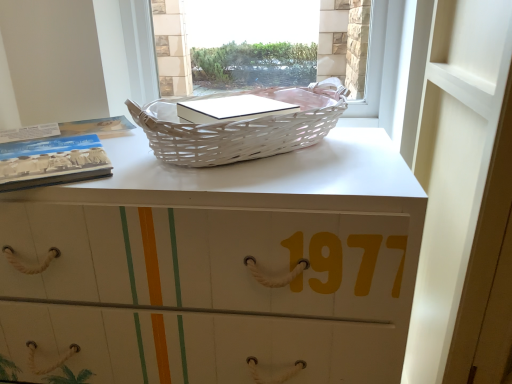
What do you see at coordinates (52, 161) in the screenshot? I see `matte paper book at left` at bounding box center [52, 161].

Where is `white wicker basket at upper center`? This screenshot has height=384, width=512. white wicker basket at upper center is located at coordinates (372, 65).

How different are the orientations of white wicker basket at upper center and white wicker picnic basket at upper center in degrees?

white wicker basket at upper center and white wicker picnic basket at upper center are facing 0.77 degrees away from each other.

The height and width of the screenshot is (384, 512). Identify the location of window behind the white wicker picnic basket at upper center. (372, 65).

Is white wicker basket at upper center at the right side of white wicker picnic basket at upper center?

Yes.

Is the depth of white wicker basket at upper center greater than that of white wicker picnic basket at upper center?

Yes, the depth of white wicker basket at upper center is greater than that of white wicker picnic basket at upper center.

Considering the positions of point (109, 236) and point (156, 112), is point (109, 236) closer or farther from the camera than point (156, 112)?

Point (109, 236) is positioned closer to the camera compared to point (156, 112).

Which object is positioned more to the right, white matte desk at center or white wicker picnic basket at upper center?

white wicker picnic basket at upper center is more to the right.

How far apart are white matte desk at center and white wicker picnic basket at upper center?

white matte desk at center is 8.73 inches away from white wicker picnic basket at upper center.

In the image, there is a white wicker picnic basket at upper center. Identify the location of desk below it (from the image's perspective). click(x=218, y=266).

Considering the relative positions of white matte desk at center and white wicker basket at upper center in the image provided, is white matte desk at center to the right of white wicker basket at upper center from the viewer's perspective?

In fact, white matte desk at center is to the left of white wicker basket at upper center.

Do you think white matte desk at center is within white wicker basket at upper center, or outside of it?

white matte desk at center is outside white wicker basket at upper center.

Considering the positions of objects white matte desk at center and white wicker basket at upper center in the image provided, who is behind, white matte desk at center or white wicker basket at upper center?

white wicker basket at upper center is behind.

Is point (386, 218) farther from camera compared to point (323, 37)?

No, it is not.

Does matte paper book at left come behind white matte desk at center?

Yes, matte paper book at left is further from the viewer.

In the scene shown: How different are the orientations of matte paper book at left and white matte desk at center in degrees?

The facing directions of matte paper book at left and white matte desk at center are 32.7 degrees apart.

Who is taller, matte paper book at left or white matte desk at center?

white matte desk at center is taller.

Between matte paper book at left and white matte desk at center, which one has smaller width?

With smaller width is matte paper book at left.

Considering the relative positions of white wicker picnic basket at upper center and white wicker basket at upper center in the image provided, is white wicker picnic basket at upper center to the right of white wicker basket at upper center from the viewer's perspective?

No.

Is white wicker basket at upper center inside white wicker picnic basket at upper center?

No, white wicker basket at upper center is not surrounded by white wicker picnic basket at upper center.

Is white wicker picnic basket at upper center positioned with its back to white wicker basket at upper center?

Yes, white wicker picnic basket at upper center is positioned with its back facing white wicker basket at upper center.

Is white wicker picnic basket at upper center smaller than white wicker basket at upper center?

Yes.

Is white matte desk at center situated inside matte paper book at left or outside?

white matte desk at center is not enclosed by matte paper book at left.

From a real-world perspective, which is physically below, white matte desk at center or matte paper book at left?

white matte desk at center is physically lower.

Is white matte desk at center bigger or smaller than matte paper book at left?

white matte desk at center is bigger than matte paper book at left.

Which of these two, white matte desk at center or matte paper book at left, stands taller?

Standing taller between the two is white matte desk at center.

Which is more to the left, white wicker basket at upper center or matte paper book at left?

Positioned to the left is matte paper book at left.

Is white wicker basket at upper center turned away from matte paper book at left?

white wicker basket at upper center is not turned away from matte paper book at left.

From a real-world perspective, between white wicker basket at upper center and matte paper book at left, who is vertically lower?

From a 3D spatial view, matte paper book at left is below.

Can you confirm if white wicker basket at upper center is thinner than matte paper book at left?

Correct, the width of white wicker basket at upper center is less than that of matte paper book at left.

Identify the location of picnic basket in front of the white wicker basket at upper center. (241, 128).

At what (x,y) coordinates should I click in order to perform the action: click on picnic basket above the white matte desk at center (from the image's perspective). Please return your answer as a coordinate pair (x, y). Looking at the image, I should click on (241, 128).

From the image, which object appears to be farther from white wicker picnic basket at upper center, matte paper book at left or white matte desk at center?

matte paper book at left lies further to white wicker picnic basket at upper center than the other object.

From the image, which object appears to be nearer to white wicker picnic basket at upper center, white wicker basket at upper center or matte paper book at left?

matte paper book at left.

Estimate the real-world distances between objects in this image. Which object is closer to white matte desk at center, white wicker basket at upper center or matte paper book at left?

matte paper book at left.

Considering their positions, is white wicker basket at upper center positioned closer to white matte desk at center than white wicker picnic basket at upper center?

The object closer to white matte desk at center is white wicker picnic basket at upper center.

When comparing their distances from white wicker basket at upper center, does matte paper book at left or white matte desk at center seem closer?

white matte desk at center.

Based on the photo, based on their spatial positions, is white wicker picnic basket at upper center or matte paper book at left further from white matte desk at center?

Among the two, matte paper book at left is located further to white matte desk at center.

When comparing their distances from white wicker picnic basket at upper center, does matte paper book at left or white wicker basket at upper center seem closer?

Among the two, matte paper book at left is located nearer to white wicker picnic basket at upper center.

From the image, which object appears to be farther from matte paper book at left, white wicker picnic basket at upper center or white wicker basket at upper center?

white wicker basket at upper center is positioned further to the anchor matte paper book at left.

Identify the location of paperback book between white wicker picnic basket at upper center and white wicker basket at upper center in the front-back direction. [x=52, y=161].

Identify the location of paperback book that lies between white wicker basket at upper center and white matte desk at center from top to bottom. The width and height of the screenshot is (512, 384). (52, 161).

Where is `paperback book between white wicker picnic basket at upper center and white matte desk at center in the vertical direction`? The height and width of the screenshot is (384, 512). paperback book between white wicker picnic basket at upper center and white matte desk at center in the vertical direction is located at coordinates (52, 161).

Image resolution: width=512 pixels, height=384 pixels. I want to click on picnic basket between white wicker basket at upper center and white matte desk at center vertically, so tap(241, 128).